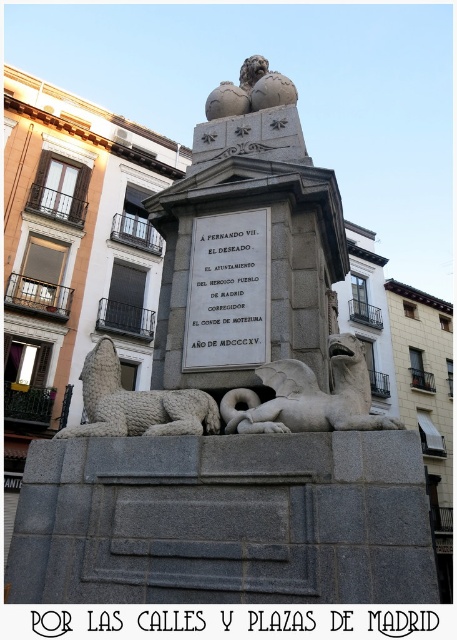
Question: Does white stone lion at lower left have a smaller size compared to gray stone lion at upper center?

Choices:
 (A) yes
 (B) no

Answer: (B)

Question: Among these points, which one is farthest from the camera?

Choices:
 (A) (203, 307)
 (B) (352, 365)
 (C) (152, 408)
 (D) (262, 81)

Answer: (D)

Question: Which object is farther from the camera taking this photo?

Choices:
 (A) white stone gryphon at lower center
 (B) white stone lion at lower left
 (C) white stone plaque at center
 (D) gray stone lion at upper center

Answer: (D)

Question: Observing the image, what is the correct spatial positioning of white stone gryphon at lower center in reference to gray stone lion at upper center?

Choices:
 (A) left
 (B) right

Answer: (B)

Question: Does white stone gryphon at lower center appear on the left side of white stone lion at lower left?

Choices:
 (A) no
 (B) yes

Answer: (A)

Question: Which of the following is the farthest from the observer?

Choices:
 (A) white stone lion at lower left
 (B) white stone gryphon at lower center
 (C) gray stone lion at upper center
 (D) white stone plaque at center

Answer: (C)